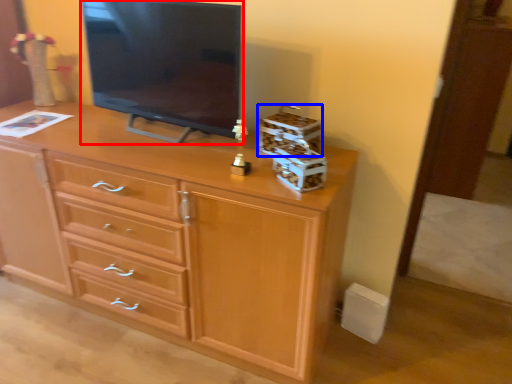
Question: Which of the following is the farthest to the observer, television (highlighted by a red box) or storage box (highlighted by a blue box)?

Choices:
 (A) television
 (B) storage box

Answer: (B)